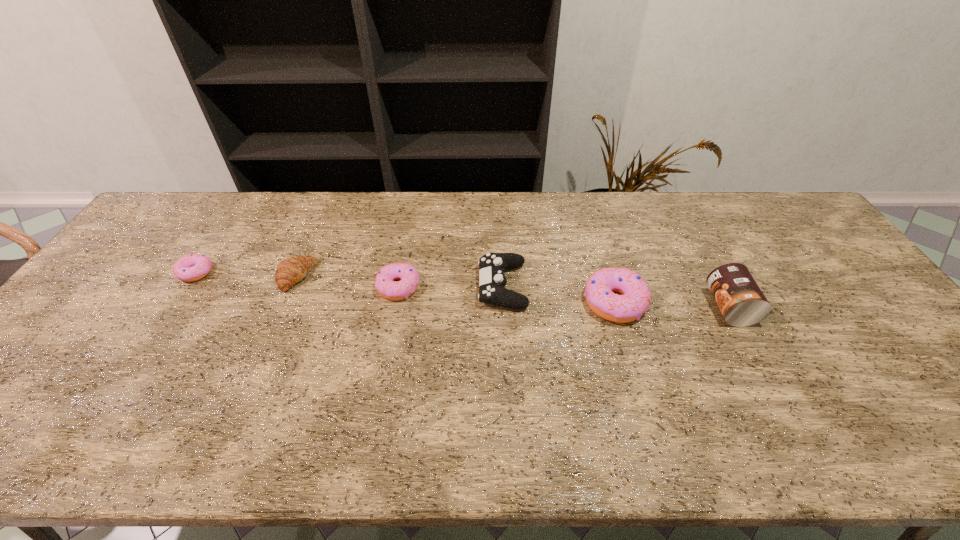
Identify the location of the leftmost object. Image resolution: width=960 pixels, height=540 pixels. (192, 267).

Where is `the shortest doughnut`? The width and height of the screenshot is (960, 540). the shortest doughnut is located at coordinates point(192,267).

Where is `the second doughnut from left to right`? the second doughnut from left to right is located at coordinates (387, 287).

At what (x,y) coordinates should I click in order to perform the action: click on the second shortest doughnut. Please return your answer as a coordinate pair (x, y). Looking at the image, I should click on (387, 287).

This screenshot has width=960, height=540. I want to click on the tallest doughnut, so pos(599,291).

Image resolution: width=960 pixels, height=540 pixels. Find the location of `the rightmost doughnut`. the rightmost doughnut is located at coordinates (599, 291).

Identify the location of control. (492, 280).

Where is `the rightmost object`? the rightmost object is located at coordinates (742, 303).

Where is `can`? The height and width of the screenshot is (540, 960). can is located at coordinates (742, 303).

Where is `the second object from left to right`? the second object from left to right is located at coordinates (292, 270).